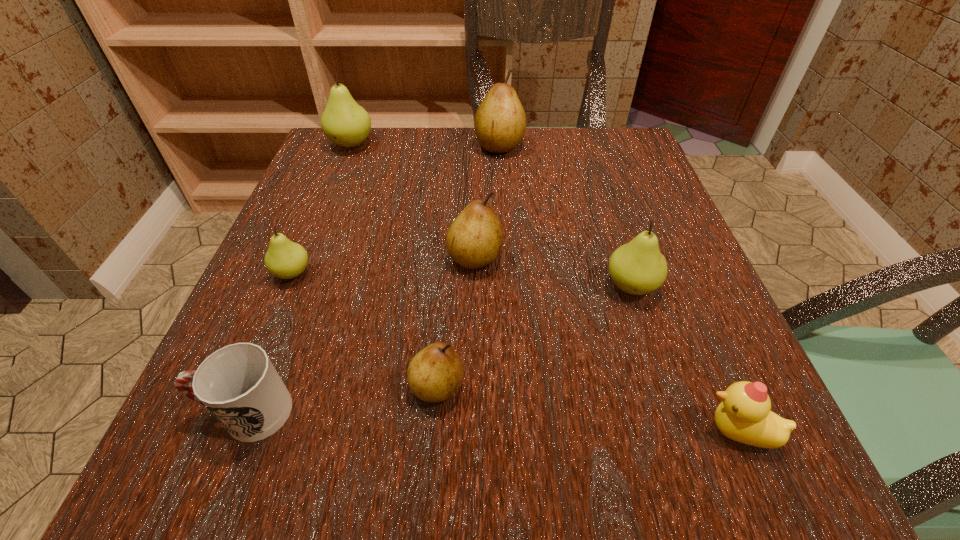
Image resolution: width=960 pixels, height=540 pixels. Identify the location of vacant region at the far left corner of the desktop. (370, 133).

At what (x,y) coordinates should I click in order to perform the action: click on free space at the near left corner of the desktop. Please return your answer as a coordinate pair (x, y). This screenshot has height=540, width=960. Looking at the image, I should click on (210, 489).

This screenshot has height=540, width=960. Identify the location of vacant point at the far right corner. (620, 127).

I want to click on free space between the biggest brown pear and the biggest green pear, so click(425, 145).

Find the location of `vacant space in between the smallest green pear and the duckling`. vacant space in between the smallest green pear and the duckling is located at coordinates (516, 353).

Where is `vacant area that lies between the smallest green pear and the rightmost pear`? vacant area that lies between the smallest green pear and the rightmost pear is located at coordinates (462, 280).

What are the coordinates of `unoccupied position between the duckling and the farthest brown pear` in the screenshot? It's located at (619, 288).

Identify the location of unoccupied area between the yellow duckling and the red cup. The height and width of the screenshot is (540, 960). (492, 422).

This screenshot has height=540, width=960. What are the coordinates of `vacant region between the biggest brown pear and the second farthest brown pear` in the screenshot? It's located at (488, 201).

The width and height of the screenshot is (960, 540). Find the location of `vacant point located between the yellow duckling and the smallest green pear`. vacant point located between the yellow duckling and the smallest green pear is located at coordinates (516, 353).